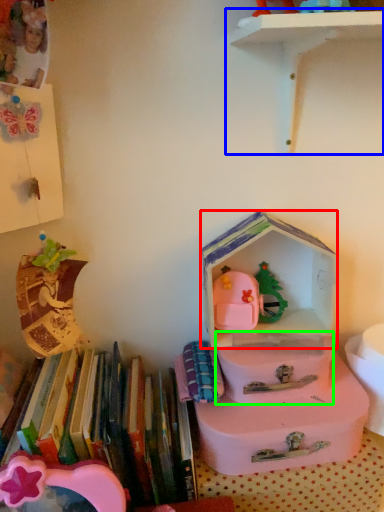
Question: Based on their relative distances, which object is nearer to storage box (highlighted by a red box)? Choose from shelf (highlighted by a blue box) and box (highlighted by a green box).

Choices:
 (A) shelf
 (B) box

Answer: (B)